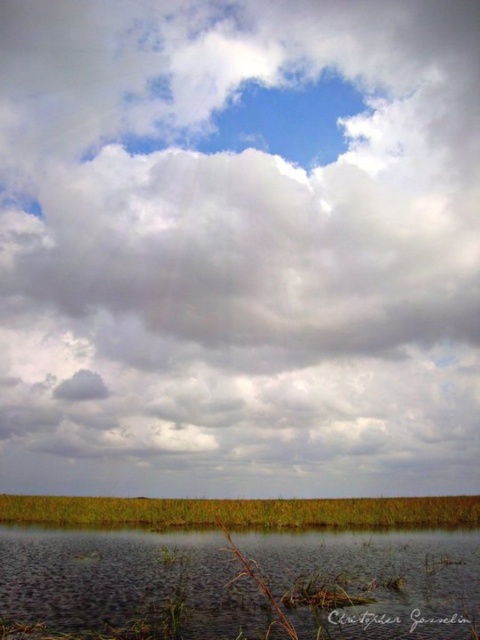
You are standing on the edge of a wetland and see the clear water at bottom and the green grass at lower center. Which area covers more ground?

The clear water at bottom is larger in size than the green grass at lower center, so the clear water at bottom covers more ground.

Consider the image. You are standing on the green grass at lower center and want to reach the clear water at bottom. Which direction should you move to get there?

You should move downward towards the clear water at bottom since it is located above the green grass at lower center.

You are standing at the edge of the wetland and want to cross to the other side. You see clear water at bottom and green grass at lower center. Which path should you choose to avoid getting your feet wet?

You should choose the green grass at lower center because the clear water at bottom is taller than the green grass at lower center, meaning the water is deeper there and more likely to get your feet wet.